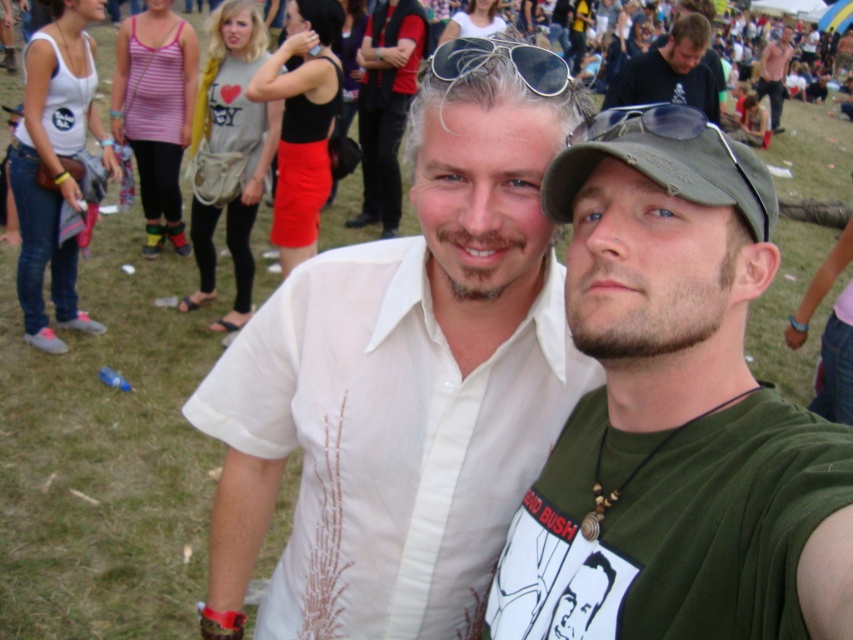
Which is behind, point (500, 189) or point (692, 88)?

Point (692, 88)

Is white cotton shirt at center wider than matte black sunglasses at upper center?

No.

Image resolution: width=853 pixels, height=640 pixels. What do you see at coordinates (402, 387) in the screenshot? I see `white cotton shirt at center` at bounding box center [402, 387].

Find the location of a particular element. white cotton shirt at center is located at coordinates (402, 387).

Between green cotton t-shirt at center and sunglasses at center, which one has less height?

sunglasses at center is shorter.

Who is positioned more to the left, green cotton t-shirt at center or sunglasses at center?

Positioned to the left is sunglasses at center.

Is point (747, 209) less distant than point (474, 38)?

Yes, it is.

I want to click on green cotton t-shirt at center, so click(674, 413).

Can you confirm if matte black sunglasses at upper center is positioned above sunglasses at center?

Yes, matte black sunglasses at upper center is above sunglasses at center.

Is point (715, 112) positioned before point (485, 44)?

No, it is behind (485, 44).

Is point (672, 99) positioned after point (457, 56)?

Yes, it is behind point (457, 56).

The width and height of the screenshot is (853, 640). What are the coordinates of `matte black sunglasses at upper center` in the screenshot? It's located at (670, 72).